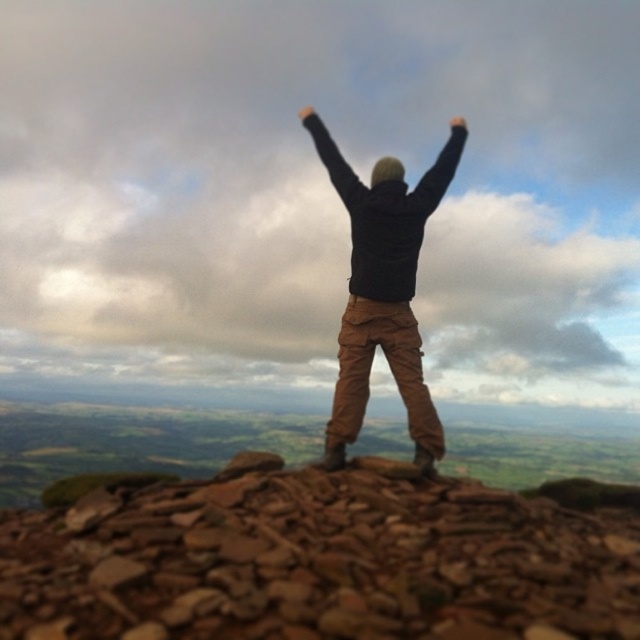
Image resolution: width=640 pixels, height=640 pixels. I want to click on brown rough rocks at center, so pos(317,561).

Who is positioned more to the left, brown rough rocks at center or black matte hand at upper center?

Positioned to the left is black matte hand at upper center.

Describe the element at coordinates (317, 561) in the screenshot. I see `brown rough rocks at center` at that location.

Find the location of `brown rough rocks at center`. brown rough rocks at center is located at coordinates (317, 561).

Can you confirm if brown rough rocks at center is bigger than black matte jacket at center?

Indeed, brown rough rocks at center has a larger size compared to black matte jacket at center.

Who is higher up, brown rough rocks at center or black matte jacket at center?

black matte jacket at center

Locate an element on the screen. The width and height of the screenshot is (640, 640). brown rough rocks at center is located at coordinates (317, 561).

Locate an element on the screen. This screenshot has height=640, width=640. brown rough rocks at center is located at coordinates (317, 561).

Does black matte jacket at center have a smaller size compared to black matte hand at upper center?

Yes.

Between point (422, 208) and point (307, 109), which one is positioned in front?

Point (422, 208)

Is point (410, 289) farther from viewer compared to point (298, 115)?

That is False.

This screenshot has height=640, width=640. What are the coordinates of `black matte jacket at center` in the screenshot? It's located at (384, 289).